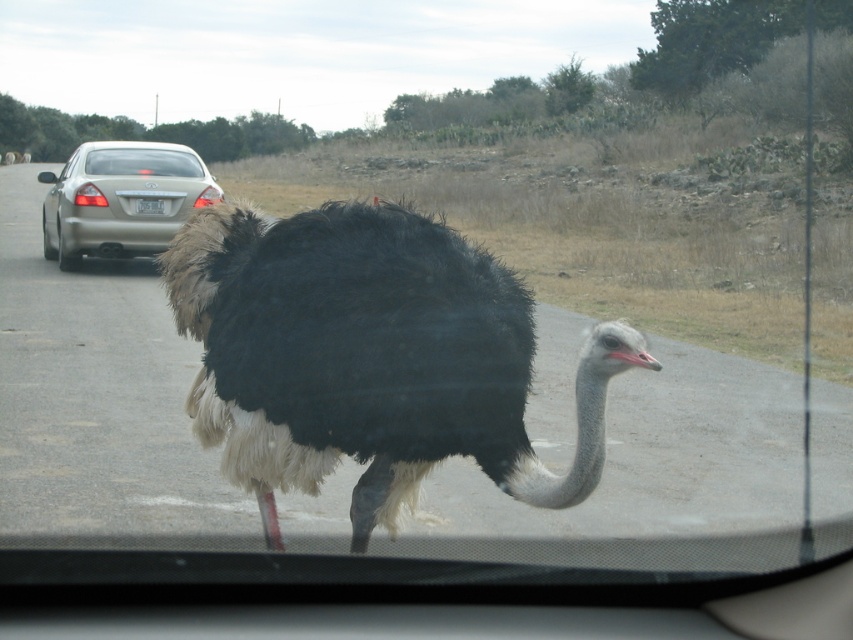
Can you confirm if black feathered ostrich at center is bigger than metallic gold sedan at left?

No.

Who is more distant from viewer, (x=439, y=282) or (x=90, y=163)?

The point (x=90, y=163) is more distant.

Who is more forward, (321, 304) or (102, 209)?

Point (321, 304)

This screenshot has height=640, width=853. Identify the location of black feathered ostrich at center. (370, 356).